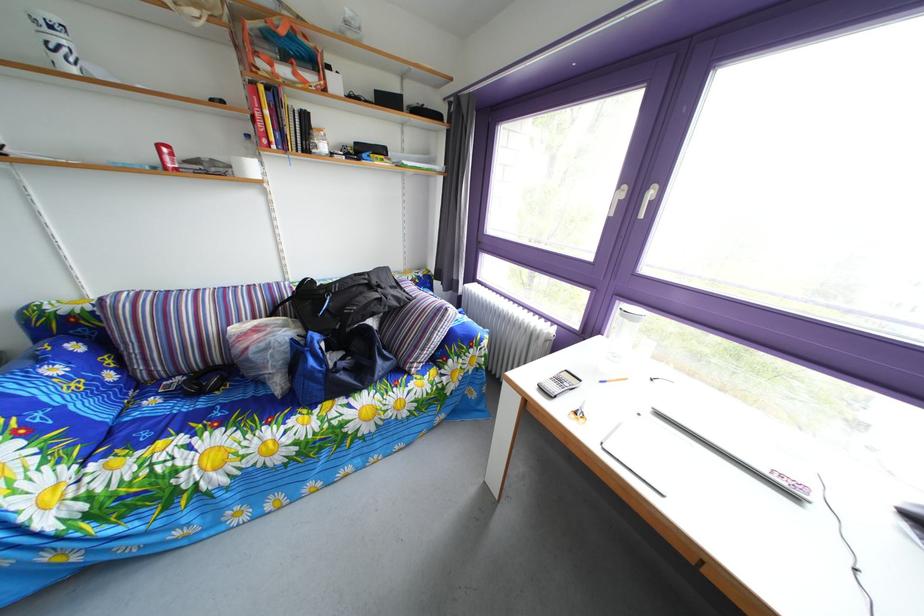
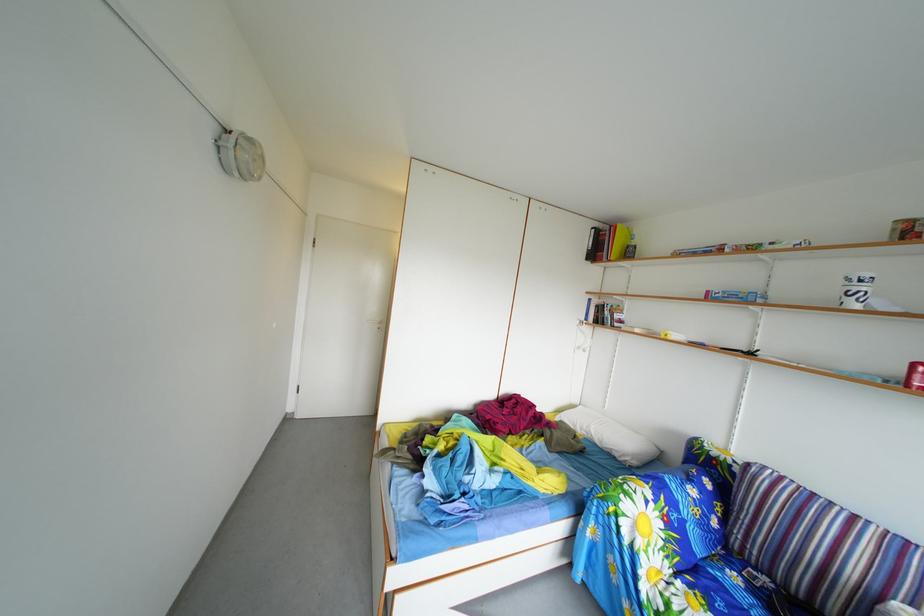
Where in the second image is the point corresponding to pixel 164 410 from the first image?

(746, 585)